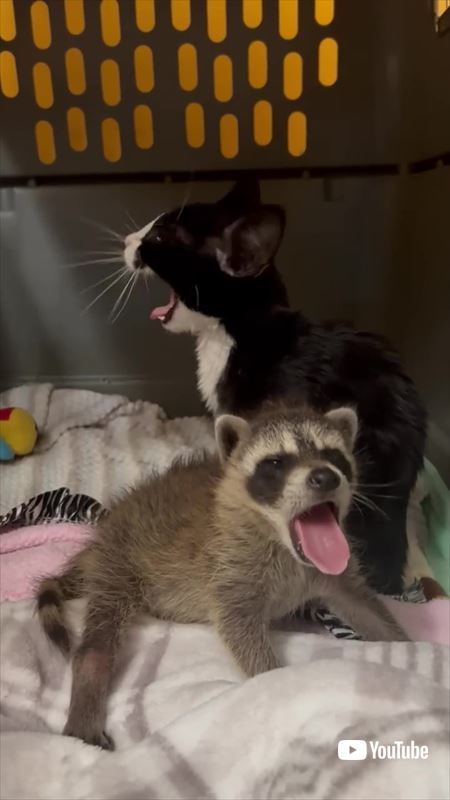
This screenshot has width=450, height=800. What are the coordinates of `toy` in the screenshot? It's located at click(x=22, y=429).